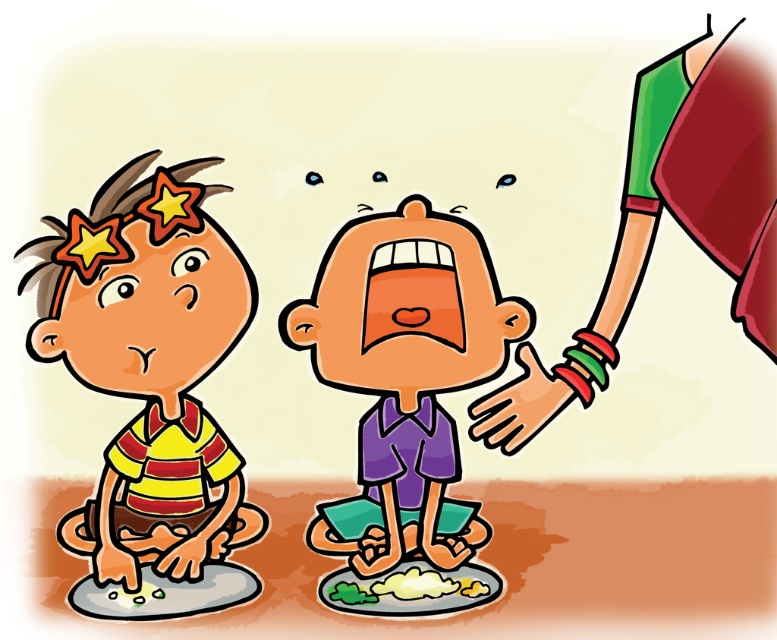
Question: Among these objects, which one is farthest from the camera?

Choices:
 (A) purple matte shirt at center
 (B) yellow striped shirt at left

Answer: (A)

Question: Is yellow striped shirt at left wider than purple matte shirt at center?

Choices:
 (A) no
 (B) yes

Answer: (A)

Question: Among these points, which one is nearest to the camera?

Choices:
 (A) (434, 442)
 (B) (164, 435)

Answer: (B)

Question: Can you confirm if yellow striped shirt at left is positioned above purple matte shirt at center?

Choices:
 (A) yes
 (B) no

Answer: (A)

Question: Can you confirm if yellow striped shirt at left is positioned above purple matte shirt at center?

Choices:
 (A) no
 (B) yes

Answer: (B)